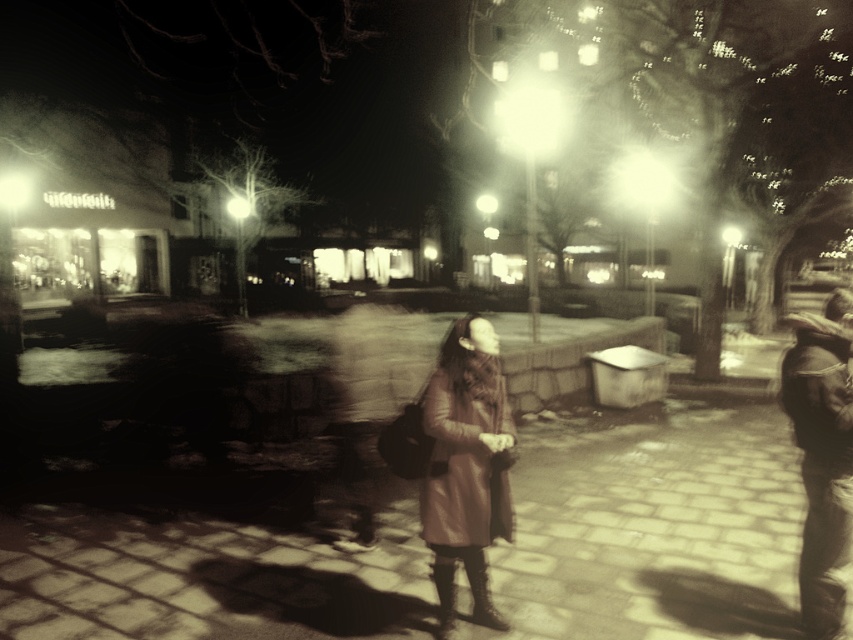
In the nighttime urban scene with a vintage filter, there are two people wearing leather coats and jackets. The first person is wearing a leather coat at center and walking away from the camera, while the second person is wearing a leather jacket at right. Which of these two items is positioned more to the left in the image?

The leather coat at center is positioned more to the left compared to the leather jacket at right.

You are standing in the nighttime plaza and want to walk to the smooth stone pavement at center. Which direction should you move relative to the leather coat at center?

The smooth stone pavement at center is to the left of the leather coat at center, so you should move to the left of the leather coat at center to reach it.